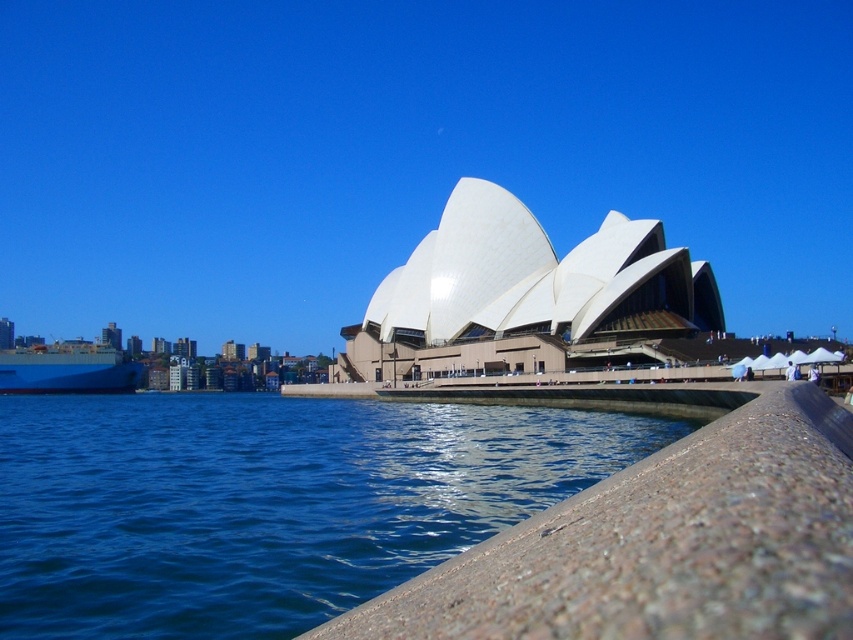
Question: Which point appears closest to the camera in this image?

Choices:
 (A) (503, 518)
 (B) (45, 369)

Answer: (A)

Question: Among these points, which one is nearest to the camera?

Choices:
 (A) (64, 369)
 (B) (281, 490)

Answer: (B)

Question: Which of the following is the farthest from the observer?

Choices:
 (A) (466, 413)
 (B) (73, 378)

Answer: (B)

Question: Can you confirm if blue water at lower left is wider than blue matte ship at left?

Choices:
 (A) yes
 (B) no

Answer: (A)

Question: Does blue water at lower left appear under blue matte ship at left?

Choices:
 (A) no
 (B) yes

Answer: (B)

Question: Does blue water at lower left appear over blue matte ship at left?

Choices:
 (A) no
 (B) yes

Answer: (A)